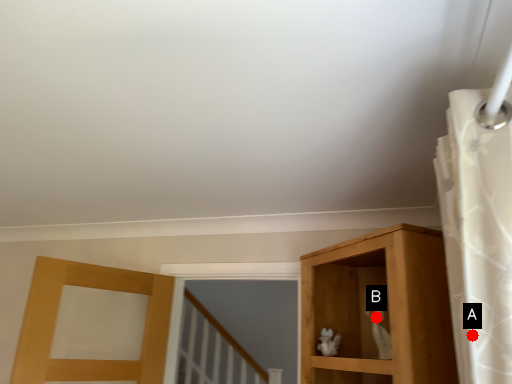
Question: Two points are circled on the image, labeled by A and B beside each circle. Among these points, which one is farthest from the camera?

Choices:
 (A) A is further
 (B) B is further

Answer: (B)